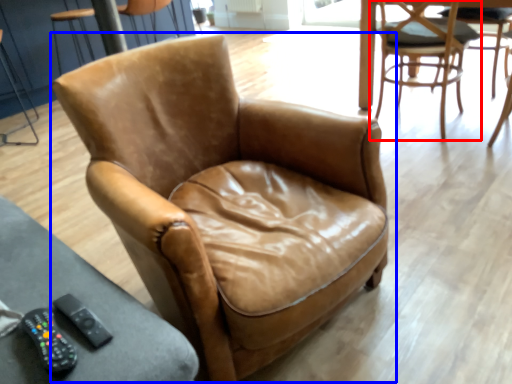
Question: Which object is closer to the camera taking this photo, chair (highlighted by a red box) or chair (highlighted by a blue box)?

Choices:
 (A) chair
 (B) chair

Answer: (B)